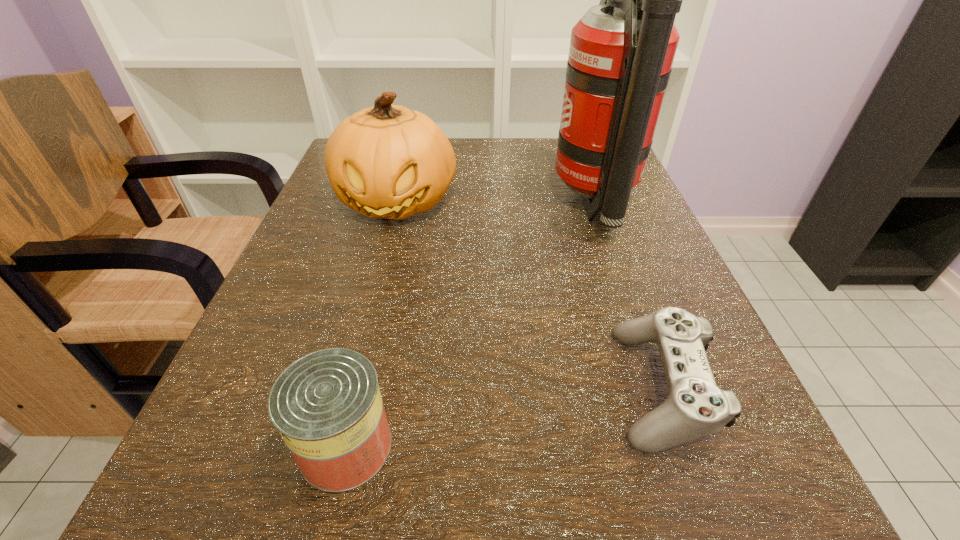
The height and width of the screenshot is (540, 960). In order to click on fire extinguisher in this screenshot , I will do point(621,53).

Locate an element on the screen. This screenshot has height=540, width=960. pumpkin is located at coordinates (387, 161).

Identify the location of the third tallest object. This screenshot has height=540, width=960. (327, 406).

You are a GUI agent. You are given a task and a screenshot of the screen. Output one action in this format:
    pyautogui.click(x=<x>, y=<y>)
    Task: Click on the shortest object
    The width and height of the screenshot is (960, 540).
    Given the screenshot: What is the action you would take?
    pyautogui.click(x=695, y=407)

Image resolution: width=960 pixels, height=540 pixels. Find the location of `free region located 0.380m on the front label side of the fire extinguisher`. free region located 0.380m on the front label side of the fire extinguisher is located at coordinates (358, 206).

The image size is (960, 540). In order to click on free space located 0.400m on the front label side of the fire extinguisher in this screenshot , I will do `click(348, 206)`.

This screenshot has height=540, width=960. Identify the location of free region located 0.050m on the front label side of the fire extinguisher. (527, 206).

Find the location of a particular element. This screenshot has width=960, height=540. vacant space located 0.140m on the front face of the pumpkin is located at coordinates (373, 293).

Locate an element on the screen. vacant space located 0.160m on the right of the second shortest object is located at coordinates (534, 446).

Where is `blank area located 0.300m on the left of the shortest object`? This screenshot has height=540, width=960. blank area located 0.300m on the left of the shortest object is located at coordinates (372, 386).